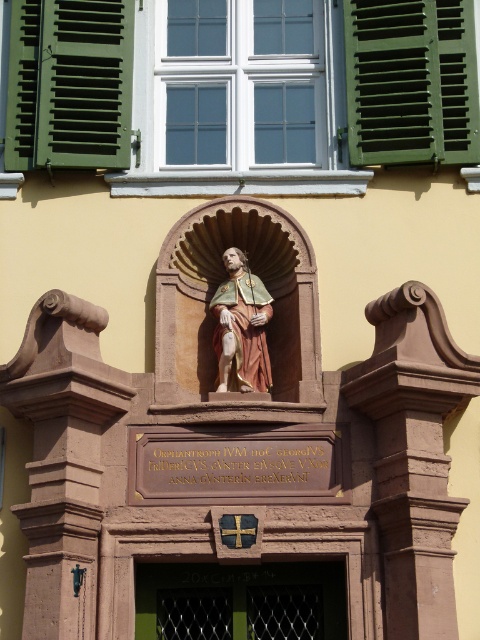
Which is more to the left, green painted wood at upper right or polychrome wood statue at center?

polychrome wood statue at center is more to the left.

Between point (420, 19) and point (217, 369), which one is positioned behind?

The point (420, 19) is behind.

You are a GUI agent. You are given a task and a screenshot of the screen. Output one action in this format:
    pyautogui.click(x=<x>, y=<y>)
    Task: Click on the green painted wood at upper right
    The image size is (480, 640).
    Given the screenshot: What is the action you would take?
    pyautogui.click(x=410, y=81)

Based on the photo, who is more forward, (58, 35) or (237, 609)?

Positioned in front is point (237, 609).

Who is taller, green matte shutters at upper left or green metal gate at lower center?

Standing taller between the two is green matte shutters at upper left.

Between point (82, 83) and point (237, 577), which one is positioned behind?

Point (82, 83)

Where is `green matte shutters at upper left`? This screenshot has height=640, width=480. green matte shutters at upper left is located at coordinates (70, 83).

Based on the photo, can you confirm if green matte shutters at upper left is wider than polychrome wood statue at center?

Indeed, green matte shutters at upper left has a greater width compared to polychrome wood statue at center.

In the scene shown: Does green matte shutters at upper left appear on the left side of polychrome wood statue at center?

Correct, you'll find green matte shutters at upper left to the left of polychrome wood statue at center.

The image size is (480, 640). I want to click on green matte shutters at upper left, so click(70, 83).